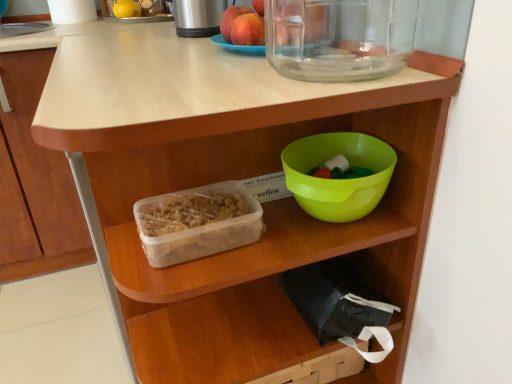
Question: Is translucent plastic container at center closer to the viewer compared to brushed metal thermos at upper center?

Choices:
 (A) yes
 (B) no

Answer: (A)

Question: Would you say translucent plastic container at center is outside brushed metal thermos at upper center?

Choices:
 (A) no
 (B) yes

Answer: (B)

Question: Can you confirm if translucent plastic container at center is smaller than brushed metal thermos at upper center?

Choices:
 (A) no
 (B) yes

Answer: (B)

Question: Is translucent plastic container at center placed right next to brushed metal thermos at upper center?

Choices:
 (A) no
 (B) yes

Answer: (A)

Question: Is translucent plastic container at center at the left side of brushed metal thermos at upper center?

Choices:
 (A) no
 (B) yes

Answer: (A)

Question: From the image's perspective, is translucent plastic container at center beneath brushed metal thermos at upper center?

Choices:
 (A) no
 (B) yes

Answer: (B)

Question: Is matte peach at upper center, the 2th apple in the back-to-front sequence, at the back of smooth peach at upper center, the second apple positioned from the front?

Choices:
 (A) yes
 (B) no

Answer: (B)

Question: Does smooth peach at upper center, acting as the first apple starting from the back, have a larger size compared to matte peach at upper center, the 1th apple positioned from the front?

Choices:
 (A) yes
 (B) no

Answer: (A)

Question: Is smooth peach at upper center, the second apple positioned from the front, positioned before matte peach at upper center, the 2th apple in the back-to-front sequence?

Choices:
 (A) no
 (B) yes

Answer: (A)

Question: Is smooth peach at upper center, the second apple positioned from the front, directly adjacent to matte peach at upper center, the 1th apple positioned from the front?

Choices:
 (A) yes
 (B) no

Answer: (A)

Question: Is smooth peach at upper center, acting as the first apple starting from the back, to the right of matte peach at upper center, the 2th apple in the back-to-front sequence, from the viewer's perspective?

Choices:
 (A) no
 (B) yes

Answer: (A)

Question: Is smooth peach at upper center, the second apple positioned from the front, outside matte peach at upper center, the 1th apple positioned from the front?

Choices:
 (A) yes
 (B) no

Answer: (A)

Question: From the image's perspective, is matte peach at upper center, the 2th apple in the back-to-front sequence, on top of green plastic bowl at center?

Choices:
 (A) yes
 (B) no

Answer: (A)